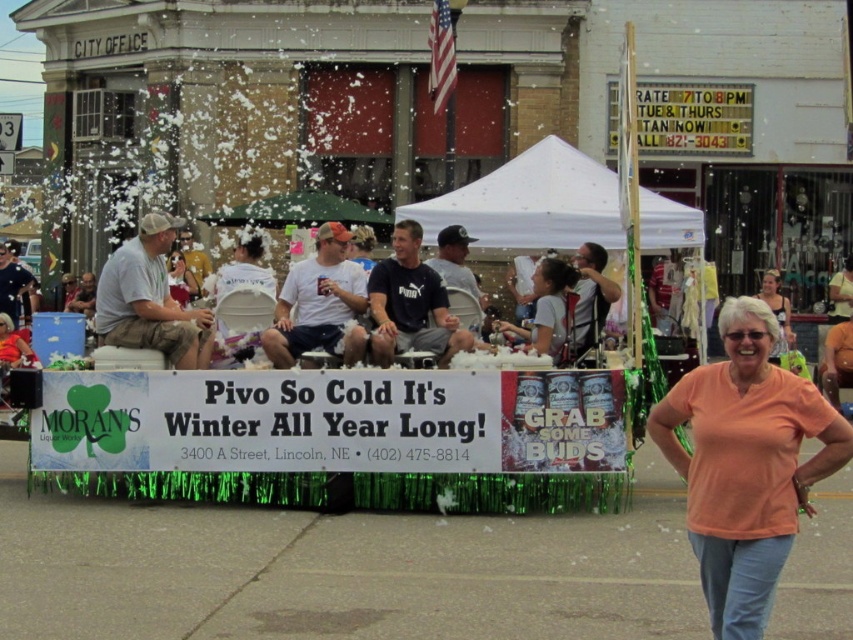
Is light gray t-shirt at center shorter than matte orange shirt at center?

Indeed, light gray t-shirt at center has a lesser height compared to matte orange shirt at center.

From the picture: Is light gray t-shirt at center in front of matte orange shirt at center?

No, light gray t-shirt at center is further to the viewer.

Is point (543, 333) farther from viewer compared to point (769, 304)?

No, it is not.

The height and width of the screenshot is (640, 853). What are the coordinates of `light gray t-shirt at center` in the screenshot? It's located at (547, 308).

Is light brown cotton shirt at left to the right of matte pink dress at center from the viewer's perspective?

Yes, light brown cotton shirt at left is to the right of matte pink dress at center.

Does point (160, 234) come behind point (183, 300)?

No.

Image resolution: width=853 pixels, height=640 pixels. Describe the element at coordinates (149, 300) in the screenshot. I see `light brown cotton shirt at left` at that location.

This screenshot has height=640, width=853. I want to click on light brown cotton shirt at left, so click(x=149, y=300).

Measure the distance between point (827,458) and camera.

Point (827,458) and camera are 6.27 meters apart.

Measure the distance from orange cotton shirt at lower right to matte pink dress at center.

orange cotton shirt at lower right is 17.18 meters from matte pink dress at center.

Which is in front, point (757, 506) or point (178, 252)?

Point (757, 506) is in front.

Locate an element on the screen. The width and height of the screenshot is (853, 640). orange cotton shirt at lower right is located at coordinates (746, 465).